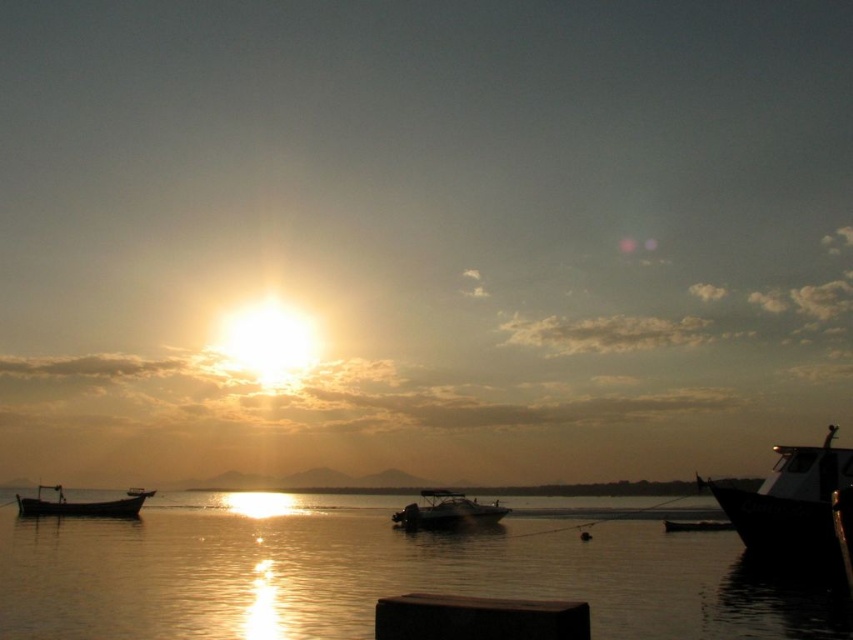
Between glistening water at center and shiny black boat at right, which one is positioned lower?

glistening water at center is below.

Between glistening water at center and shiny black boat at right, which one is positioned higher?

Positioned higher is shiny black boat at right.

Is point (77, 616) more distant than point (846, 449)?

No, it is in front of (846, 449).

At what (x,y) coordinates should I click in order to perform the action: click on glistening water at center. Please return your answer as a coordinate pair (x, y). Looking at the image, I should click on (372, 573).

Which is behind, point (431, 522) or point (103, 500)?

The point (103, 500) is behind.

Is point (462, 497) behind point (80, 509)?

No, (462, 497) is closer to viewer.

I want to click on glossy white boat at center, so click(445, 512).

From the picture: Between dark wood dock at lower center and metallic silver boat at lower right, which one is positioned lower?

metallic silver boat at lower right

What do you see at coordinates (479, 618) in the screenshot? I see `dark wood dock at lower center` at bounding box center [479, 618].

Does point (397, 608) come behind point (675, 531)?

No, it is not.

Identify the location of dark wood dock at lower center. (479, 618).